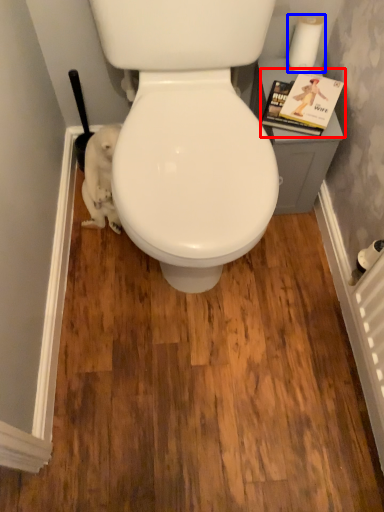
Question: Which point is closer to the camera, magazine (highlighted by a red box) or toilet paper (highlighted by a blue box)?

Choices:
 (A) magazine
 (B) toilet paper

Answer: (A)